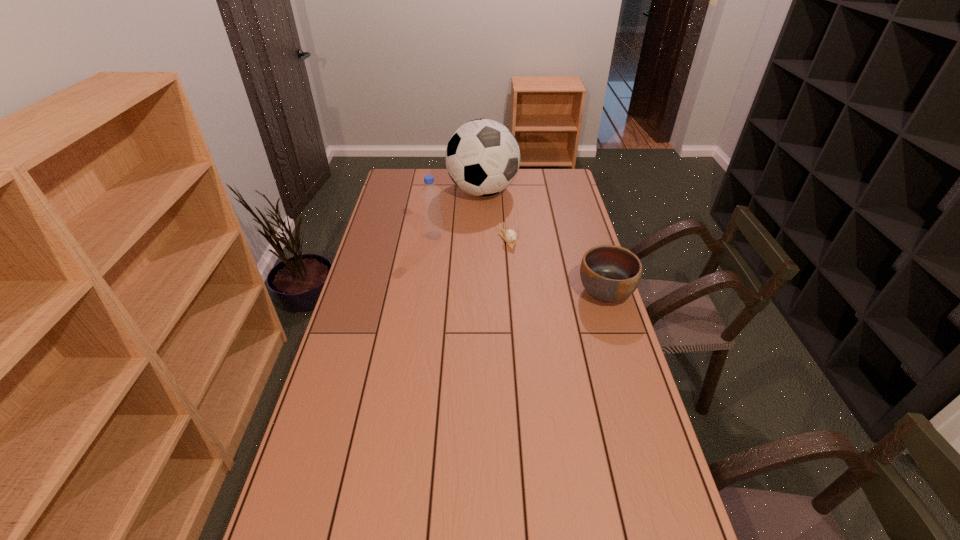
At what (x,y) coordinates should I click in order to perform the action: click on bottle. Please return your answer as a coordinate pair (x, y). The height and width of the screenshot is (540, 960). Looking at the image, I should click on (432, 224).

Image resolution: width=960 pixels, height=540 pixels. Identify the location of the rightmost object. (609, 273).

Find the location of a particular element. The height and width of the screenshot is (540, 960). bowl is located at coordinates (609, 273).

Image resolution: width=960 pixels, height=540 pixels. In order to click on the tallest object in this screenshot , I will do `click(482, 157)`.

Where is `soccer ball`? Image resolution: width=960 pixels, height=540 pixels. soccer ball is located at coordinates (482, 157).

You are a GUI agent. You are given a task and a screenshot of the screen. Output one action in this format:
    pyautogui.click(x=<x>, y=<y>)
    Task: Click on the shortest object
    
    Given the screenshot: What is the action you would take?
    pyautogui.click(x=510, y=236)

Image resolution: width=960 pixels, height=540 pixels. Find the location of `vacant space located on the front of the second tallest object`. vacant space located on the front of the second tallest object is located at coordinates (423, 309).

Where is `vacant space situated on the front of the bowl`? vacant space situated on the front of the bowl is located at coordinates (631, 374).

At what (x,y) coordinates should I click in order to perform the action: click on free region located on the main logo of the soccer ball. Please return your answer as a coordinate pair (x, y). This screenshot has width=960, height=540. Looking at the image, I should click on (527, 257).

At what (x,y) coordinates should I click in order to perform the action: click on blank area located 0.310m on the main logo of the soccer ball. Please return your answer as a coordinate pair (x, y). Image resolution: width=960 pixels, height=540 pixels. Looking at the image, I should click on (521, 248).